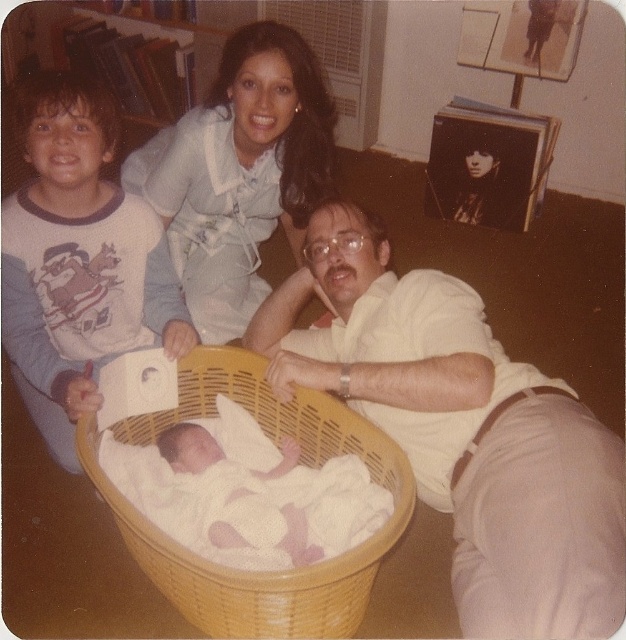
You are a photographer setting up for a family photo. You need to position a light source to the right of the white soft fabric newborn at lower left and the light blue fabric dress at upper center. Based on their positions, which object should the light be placed to the right of?

The light should be placed to the right of the white soft fabric newborn at lower left because it is positioned to the left of the light blue fabric dress at upper center, so placing the light to the right of the newborn would also be to the right of the dress.

You are a parent trying to dress your child. You have two options in the image, a white matte shirt at center and a light blue fabric dress at upper center. Which clothing item is bigger in size?

The white matte shirt at center is larger in size than the light blue fabric dress at upper center.

You are a photographer setting up for a family portrait. You need to position the white matte shirt at center and the light blue fabric dress at upper center so that they are aligned properly. According to the scene description, which object should be placed to the right side?

The white matte shirt at center should be placed to the right of the light blue fabric dress at upper center.